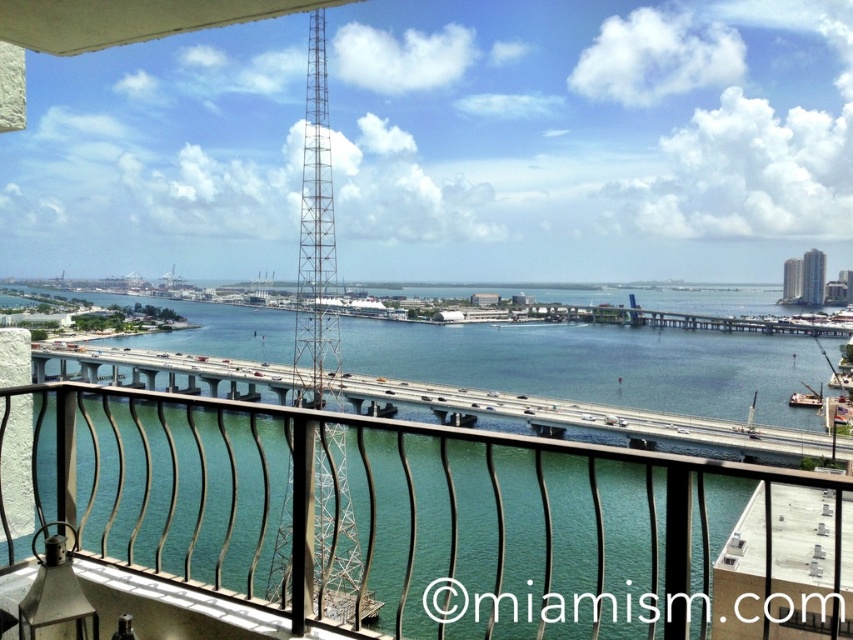
Who is more distant from viewer, (222,339) or (322,168)?

Positioned behind is point (322,168).

Is clear blue water at center to the left of metallic lattice tower at center from the viewer's perspective?

Indeed, clear blue water at center is positioned on the left side of metallic lattice tower at center.

In order to click on clear blue water at center in this screenshot , I will do `click(598, 364)`.

Where is `clear blue water at center`? Image resolution: width=853 pixels, height=640 pixels. clear blue water at center is located at coordinates (598, 364).